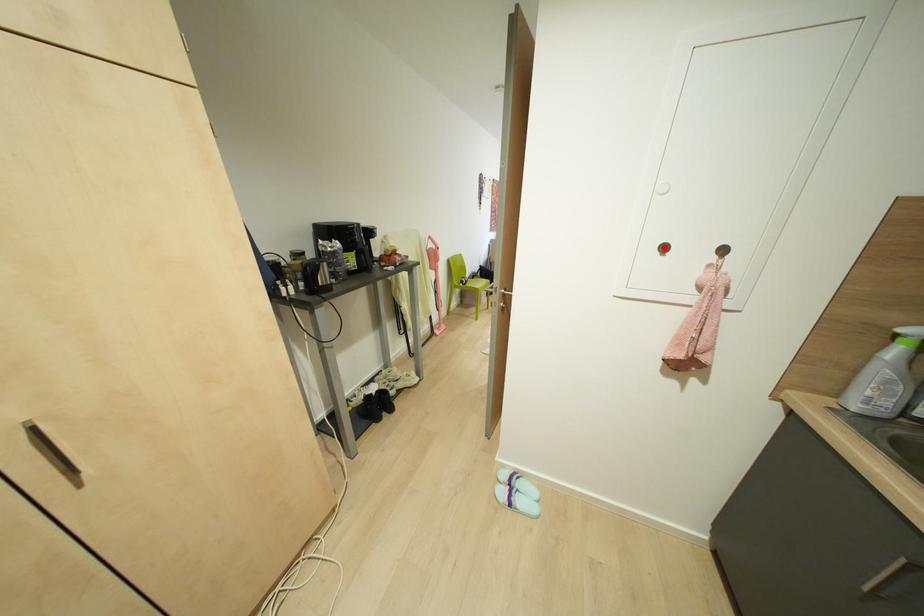
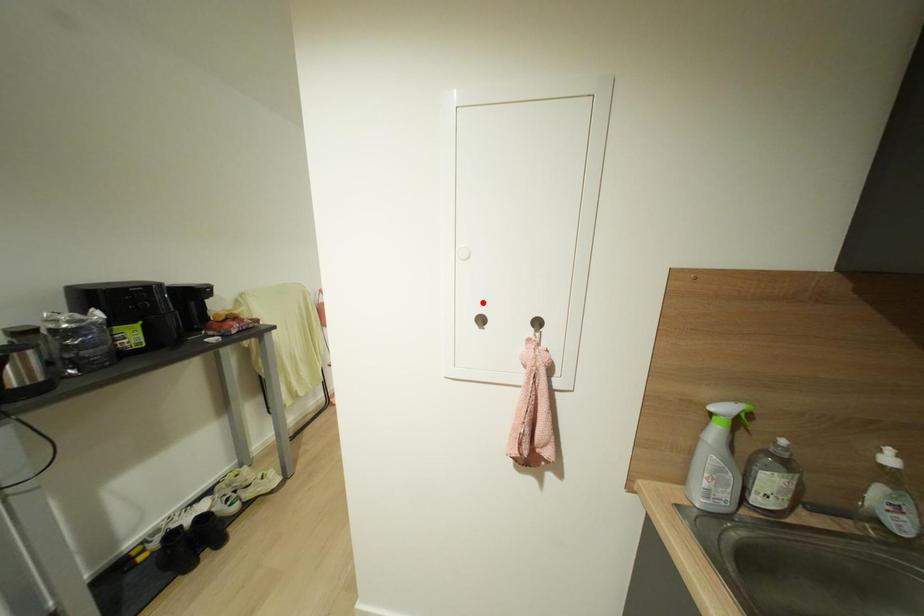
I am providing you with two images of the same scene from different viewpoints. A red point is marked on the first image and another point is marked on the second image. Is the marked point in image1 the same physical position as the marked point in image2?

No